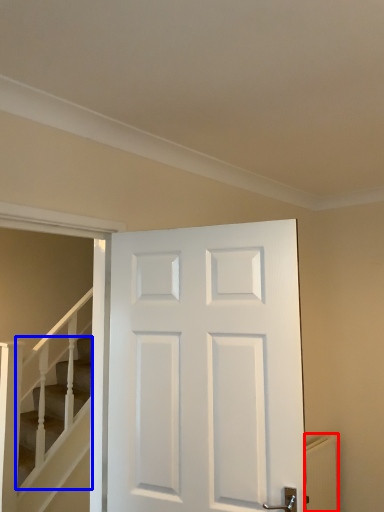
Question: Which object appears farthest to the camera in this image, radiator (highlighted by a red box) or stairs (highlighted by a blue box)?

Choices:
 (A) radiator
 (B) stairs

Answer: (A)